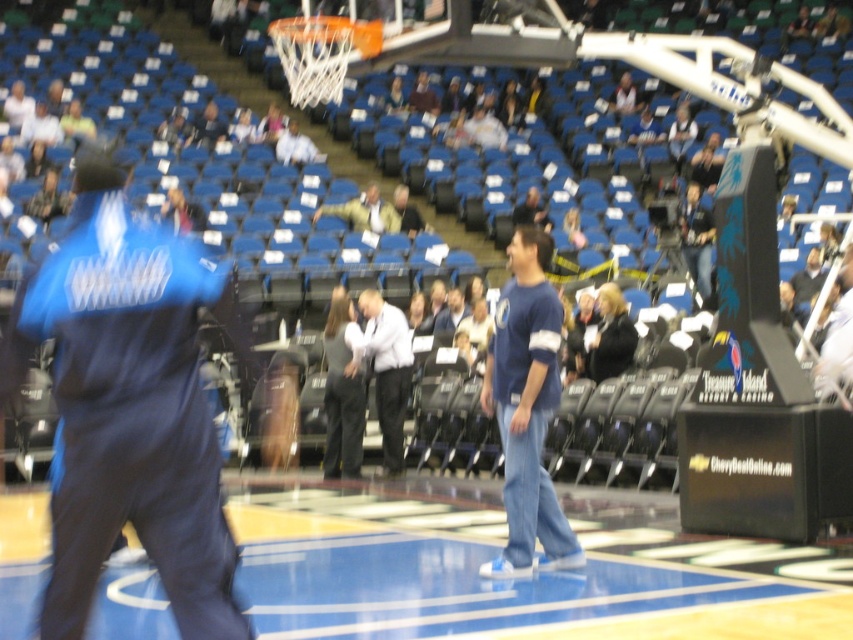
You are standing at the center of the basketball court and see two points marked on the floor. Which point is closer to you, point at coordinate (25, 502) or point at coordinate (402, 460)?

Point at coordinate (25, 502) is closer to the camera than point at coordinate (402, 460).

You are organizing a clothing donation drive and need to pack items into boxes. You have a box that can only hold items up to 2 inches thick. You have the blue cotton shirt at center and the light brown leather jacket at center. Which item can fit into the box based on their thickness?

The blue cotton shirt at center is thinner than the light brown leather jacket at center, so the blue cotton shirt at center can fit into the box since it is under 2 inches thick.